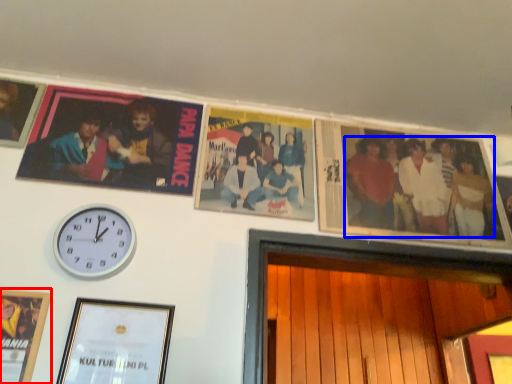
Question: Which of the following is the closest to the observer, picture frame (highlighted by a red box) or person (highlighted by a blue box)?

Choices:
 (A) picture frame
 (B) person

Answer: (A)